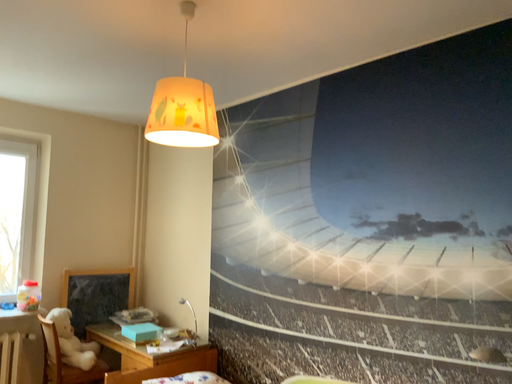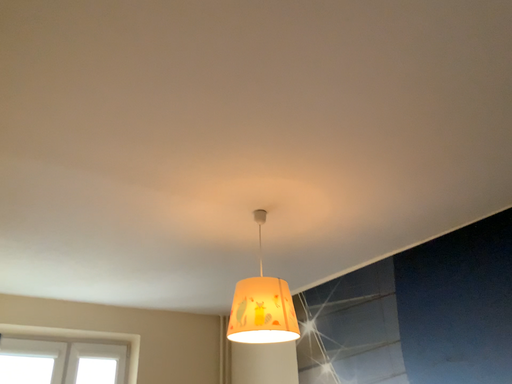
Question: How did the camera likely rotate when shooting the video?

Choices:
 (A) rotated downward
 (B) rotated upward

Answer: (B)